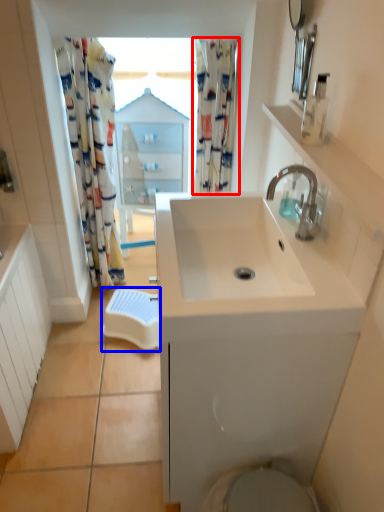
Question: Which point is closer to the camera, shower curtain (highlighted by a red box) or beach towel (highlighted by a blue box)?

Choices:
 (A) shower curtain
 (B) beach towel

Answer: (A)